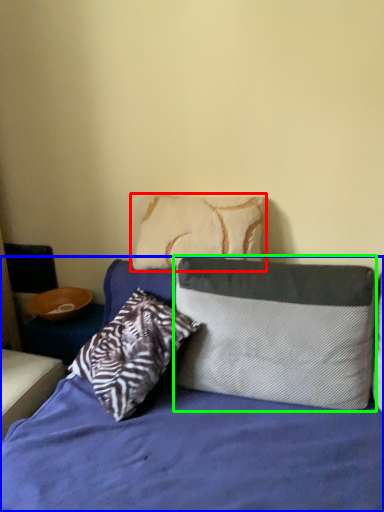
Question: Which object is the farthest from pillow (highlighted by a red box)? Choose among these: bed (highlighted by a blue box) or pillow (highlighted by a green box).

Choices:
 (A) bed
 (B) pillow

Answer: (A)